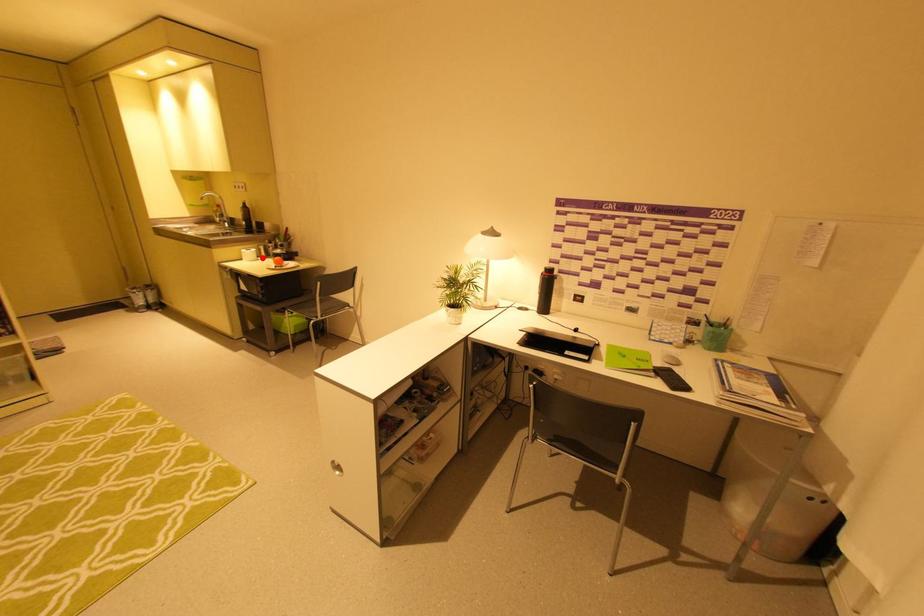
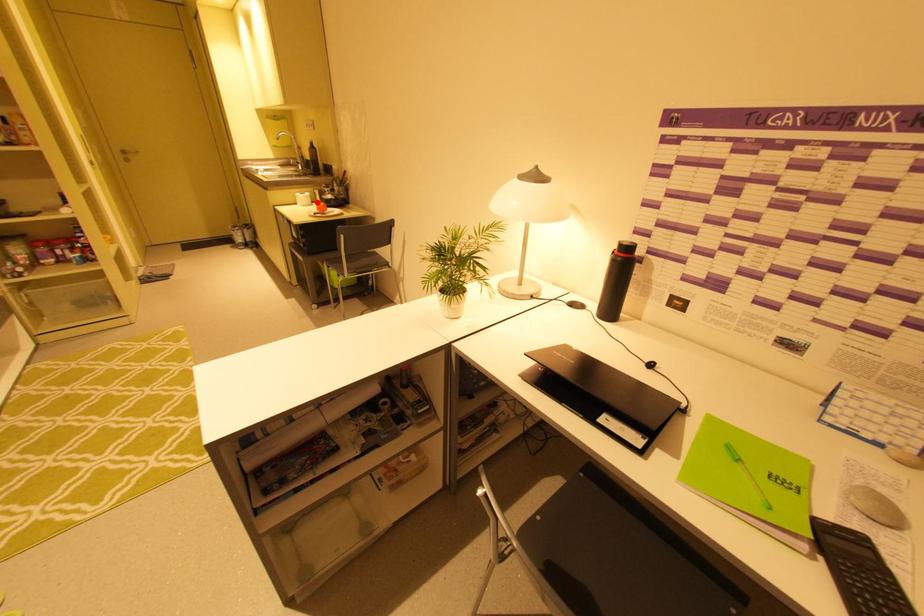
I am providing you with two images of the same scene from different viewpoints. A red point is marked on the first image and another point is marked on the second image. Is the marked point in image1 the same physical position as the marked point in image2?

Yes